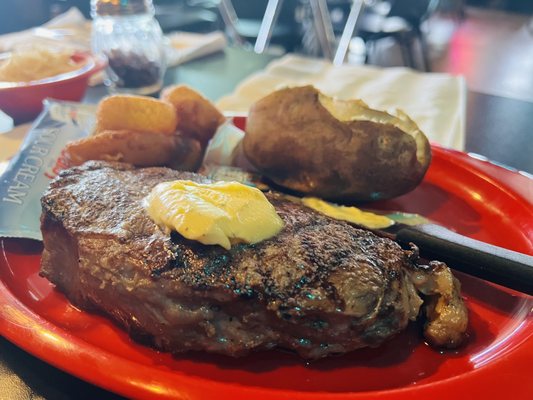
Where is `sauce container`? This screenshot has height=400, width=533. sauce container is located at coordinates (219, 138).